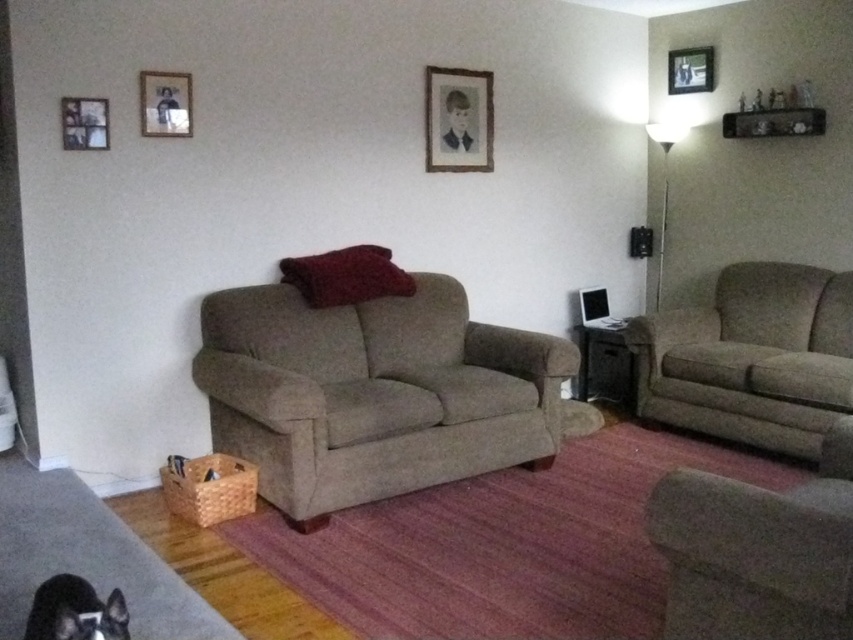
Can you confirm if matte gray armchair at right is positioned to the left of black plastic speaker at center?

Correct, you'll find matte gray armchair at right to the left of black plastic speaker at center.

Is matte gray armchair at right behind black plastic speaker at center?

No, it is in front of black plastic speaker at center.

Between point (648, 532) and point (611, 342), which one is positioned behind?

Positioned behind is point (611, 342).

Identify the location of matte gray armchair at right. (757, 552).

Which is more to the left, textured beige couch at right or wooden picture frame at upper center?

wooden picture frame at upper center

Can you confirm if textured beige couch at right is positioned to the left of wooden picture frame at upper center?

In fact, textured beige couch at right is to the right of wooden picture frame at upper center.

Who is more forward, (670, 340) or (701, 52)?

Positioned in front is point (670, 340).

Where is `textured beige couch at right`? textured beige couch at right is located at coordinates (752, 358).

Which is below, beige fabric couch at center or black paper at upper center?

beige fabric couch at center

Between beige fabric couch at center and black paper at upper center, which one is positioned higher?

Positioned higher is black paper at upper center.

Who is more distant from viewer, (421, 305) or (444, 134)?

Point (444, 134)

Find the location of `beige fabric couch at center`. beige fabric couch at center is located at coordinates (373, 394).